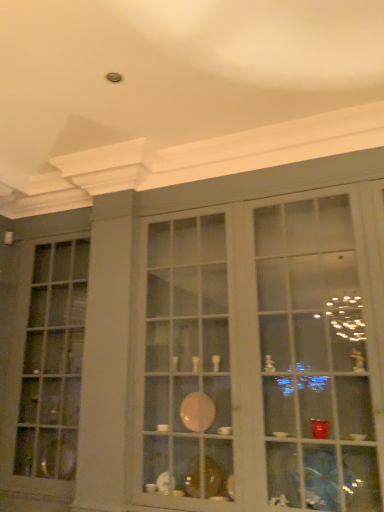
Question: Can you confirm if matte glass window at left is shorter than matte glass cabinet at center?

Choices:
 (A) yes
 (B) no

Answer: (B)

Question: Is matte glass window at left not inside matte glass cabinet at center?

Choices:
 (A) no
 (B) yes

Answer: (B)

Question: Is matte glass window at left beside matte glass cabinet at center?

Choices:
 (A) no
 (B) yes

Answer: (A)

Question: From the image's perspective, is matte glass window at left under matte glass cabinet at center?

Choices:
 (A) yes
 (B) no

Answer: (A)

Question: From the image's perspective, is matte glass window at left over matte glass cabinet at center?

Choices:
 (A) yes
 (B) no

Answer: (B)

Question: Considering the relative sizes of matte glass window at left and matte glass cabinet at center in the image provided, is matte glass window at left wider than matte glass cabinet at center?

Choices:
 (A) yes
 (B) no

Answer: (B)

Question: Is matte glass cabinet at center facing away from matte glass window at left?

Choices:
 (A) yes
 (B) no

Answer: (B)

Question: Does matte glass cabinet at center come in front of matte glass window at left?

Choices:
 (A) no
 (B) yes

Answer: (B)

Question: Does matte glass cabinet at center have a smaller size compared to matte glass window at left?

Choices:
 (A) yes
 (B) no

Answer: (B)

Question: Does matte glass cabinet at center have a greater width compared to matte glass window at left?

Choices:
 (A) no
 (B) yes

Answer: (B)

Question: Does matte glass cabinet at center turn towards matte glass window at left?

Choices:
 (A) no
 (B) yes

Answer: (A)

Question: From the image's perspective, is matte glass cabinet at center under matte glass window at left?

Choices:
 (A) yes
 (B) no

Answer: (B)

Question: Is matte glass cabinet at center inside the boundaries of matte glass window at left, or outside?

Choices:
 (A) inside
 (B) outside

Answer: (B)